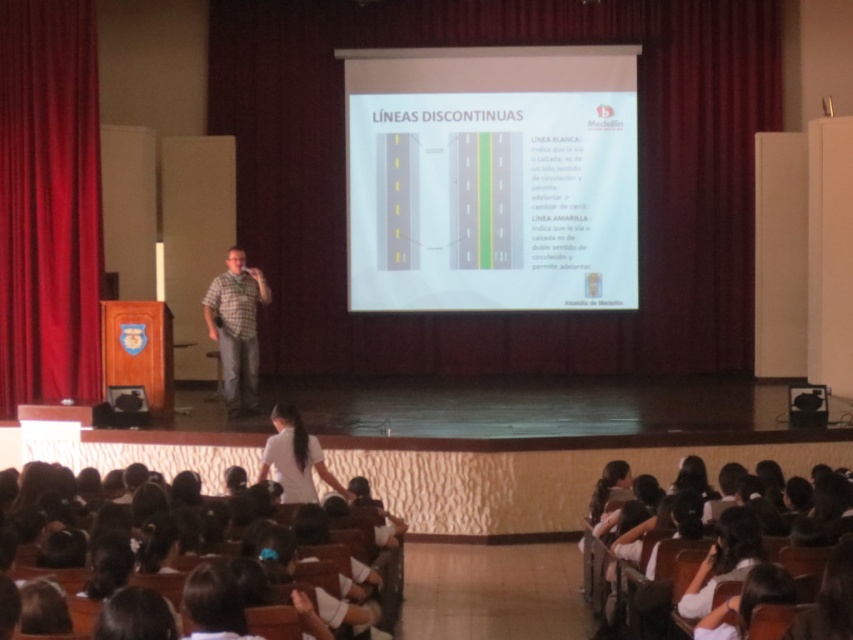
Based on the photo, you are an attendee at the presentation. You notice two white items in the scene. The first is the white paper at center, and the second is the white uniform at lower center. Which of these two items is narrower in width?

The white paper at center is thinner than the white uniform at lower center, so the white paper at center is narrower in width.

You are a student sitting in the classroom and want to know which of the two points, point [407,227] or point [380,605], is closer to the front of the stage. Based on their positions, which point is positioned behind the other?

Point [407,227] is behind point [380,605], so the latter is closer to the front of the stage.